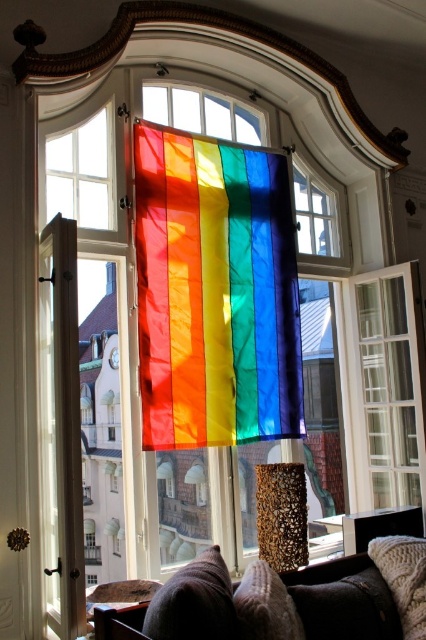
Is velvety dark brown pillow at lower center thinner than knitted white pillow at lower right?

No.

Does point (301, 611) come in front of point (423, 621)?

Yes, point (301, 611) is in front of point (423, 621).

Does point (305, 593) lie behind point (408, 541)?

No.

Identify the location of velvety dark brown pillow at lower center. (344, 602).

Who is positioned more to the right, clear glass window at center or rainbow stained glass at center?

Positioned to the right is clear glass window at center.

Between point (388, 448) and point (146, 116), which one is positioned behind?

Positioned behind is point (388, 448).

The image size is (426, 640). I want to click on clear glass window at center, so click(391, 381).

This screenshot has width=426, height=640. I want to click on clear glass window at center, so click(391, 381).

Is point (48, 138) less distant than point (296, 230)?

Yes, point (48, 138) is in front of point (296, 230).

Between point (111, 112) and point (304, 232), which one is positioned in front?

Point (111, 112) is more forward.

What do you see at coordinates (81, 172) in the screenshot? I see `clear glass window at upper left` at bounding box center [81, 172].

You are a GUI agent. You are given a task and a screenshot of the screen. Output one action in this format:
    pyautogui.click(x=<x>, y=<y>)
    Task: Click on the clear glass window at upper left
    This screenshot has width=426, height=640.
    Given the screenshot: What is the action you would take?
    pyautogui.click(x=81, y=172)